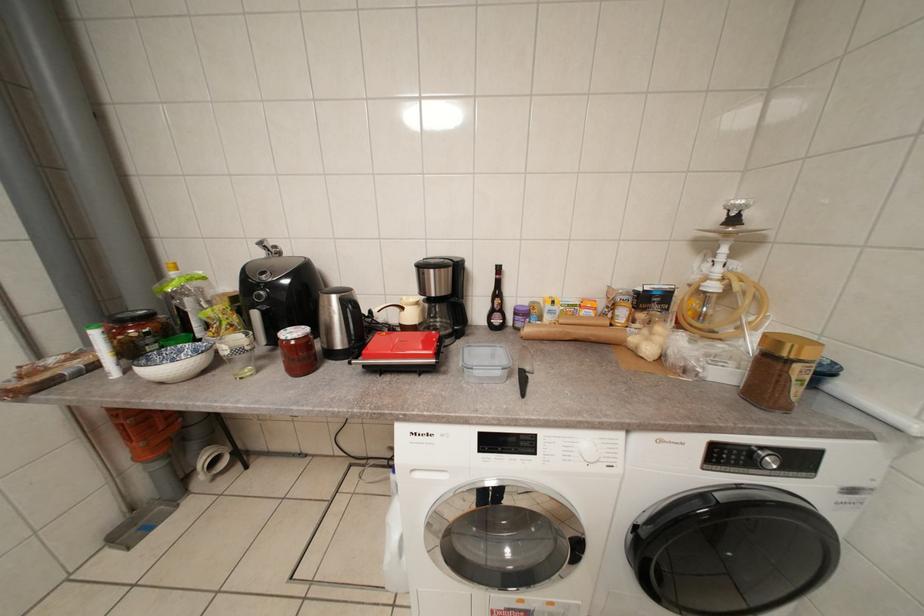
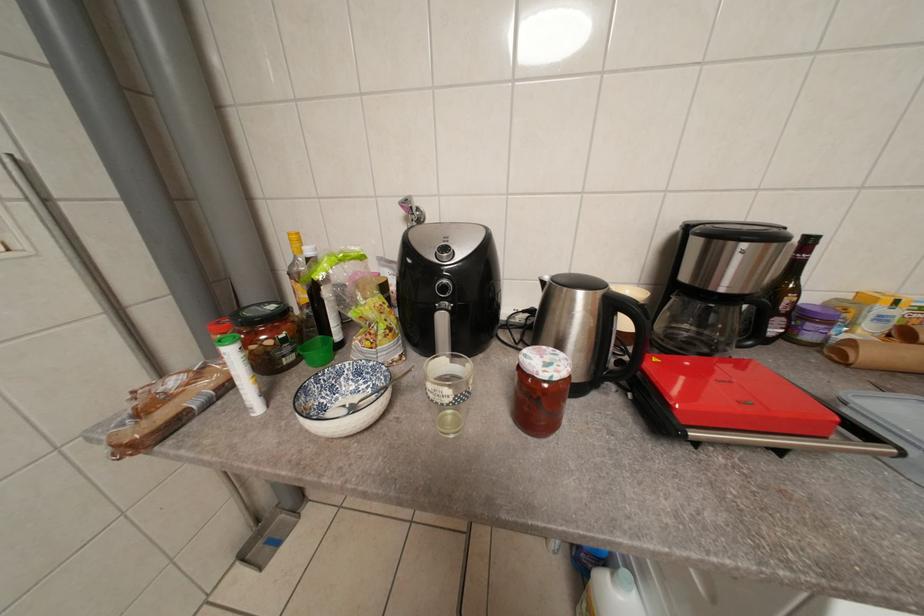
Question: The camera is either moving clockwise (left) or counter-clockwise (right) around the object. The first image is from the beginning of the video and the second image is from the end. Is the camera moving left or right when shooting the video?

Choices:
 (A) Left
 (B) Right

Answer: (B)